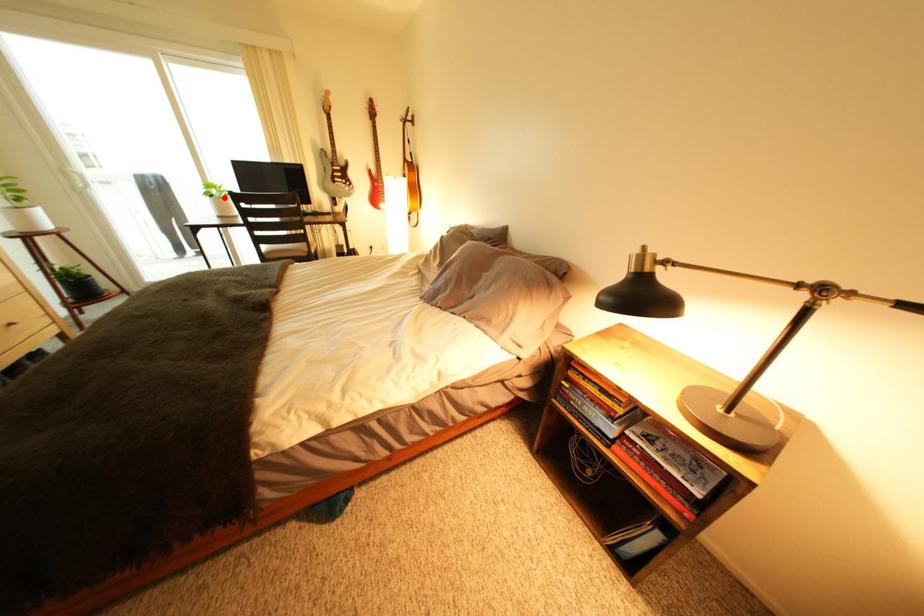
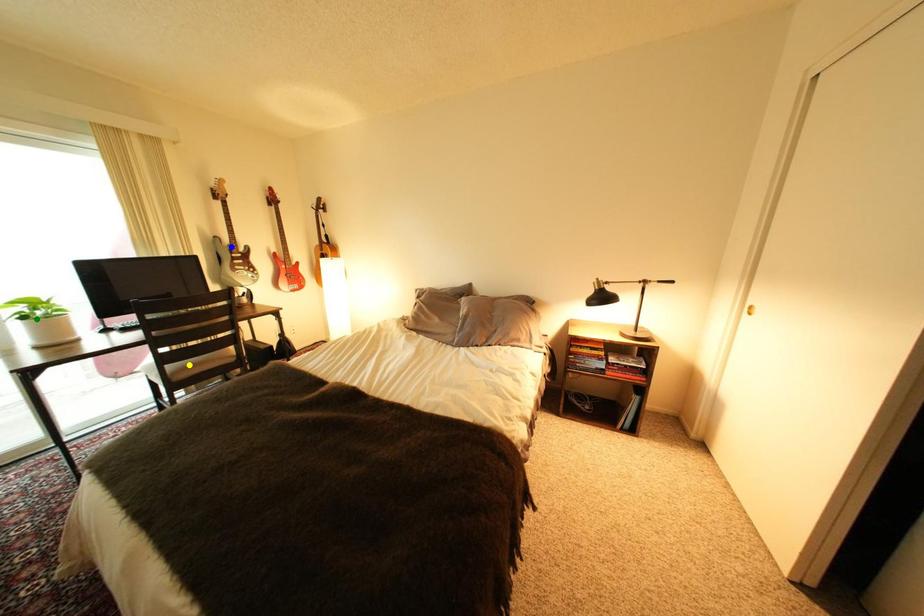
Question: I am providing you with two images of the same scene from different viewpoints. A red point is marked on the first image. You are given multiple points on the second image. Which point in image 2 represents the same 3d spot as the red point in image 1?

Choices:
 (A) green point
 (B) yellow point
 (C) blue point

Answer: (A)